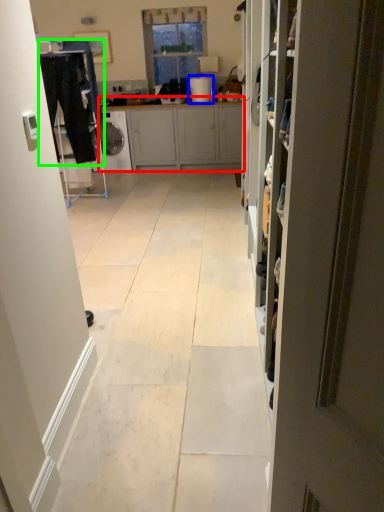
Question: Considering the real-world distances, which object is closest to cabinetry (highlighted by a red box)? appliance (highlighted by a blue box) or laundry (highlighted by a green box).

Choices:
 (A) appliance
 (B) laundry

Answer: (A)